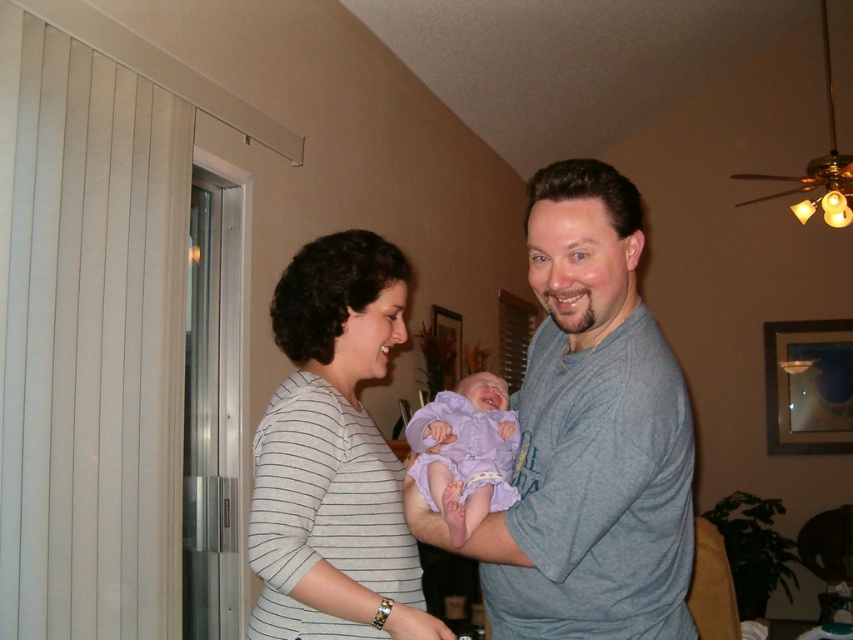
Which is above, gray cotton shirt at center or purple satin baby at center?

gray cotton shirt at center is higher up.

Between point (593, 209) and point (488, 497), which one is positioned in front?

Point (593, 209) is in front.

This screenshot has width=853, height=640. I want to click on gray cotton shirt at center, so (x=592, y=435).

What do you see at coordinates (334, 456) in the screenshot? I see `white striped shirt at center` at bounding box center [334, 456].

Between point (300, 598) and point (422, 408), which one is positioned in front?

Point (300, 598)

You are a GUI agent. You are given a task and a screenshot of the screen. Output one action in this format:
    pyautogui.click(x=<x>, y=<y>)
    Task: Click on the white striped shirt at center
    
    Given the screenshot: What is the action you would take?
    pyautogui.click(x=334, y=456)

Is gray cotton shirt at center below white striped shirt at center?

Actually, gray cotton shirt at center is above white striped shirt at center.

Does gray cotton shirt at center have a lesser height compared to white striped shirt at center?

No.

Image resolution: width=853 pixels, height=640 pixels. I want to click on gray cotton shirt at center, so click(x=592, y=435).